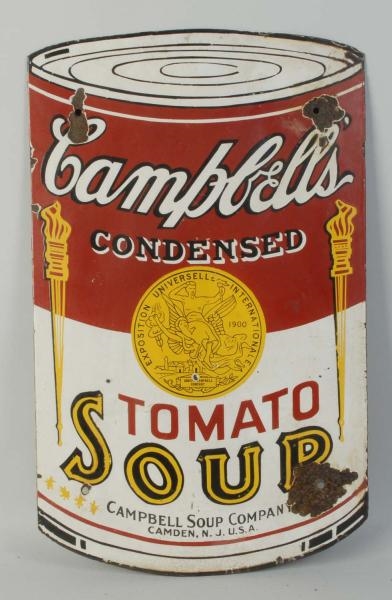
What are the coordinates of `tabletop` in the screenshot? It's located at (238, 586).